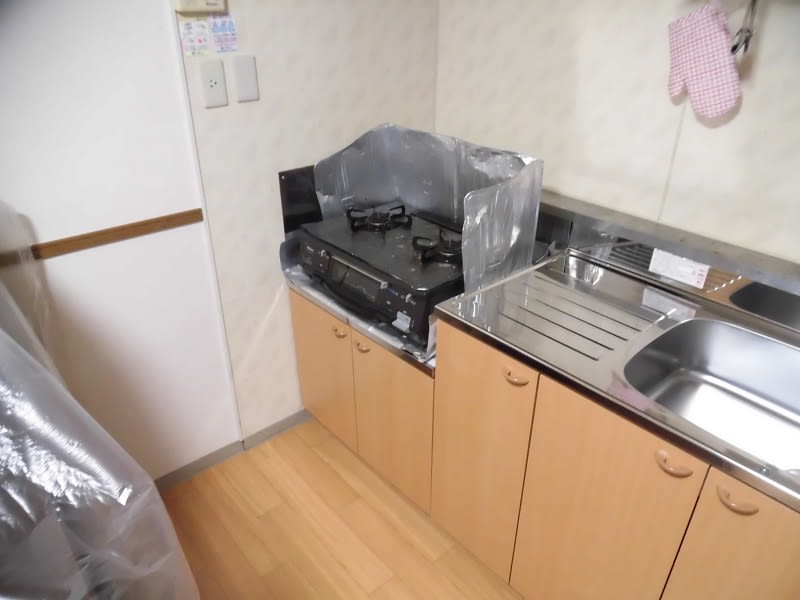
Where is `wooden board`? wooden board is located at coordinates (58, 248).